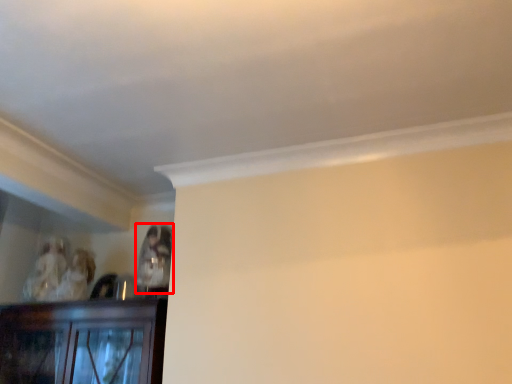
Question: From the image's perspective, what is the correct spatial positioning of person (annotated by the red box) in reference to person?

Choices:
 (A) below
 (B) above

Answer: (B)